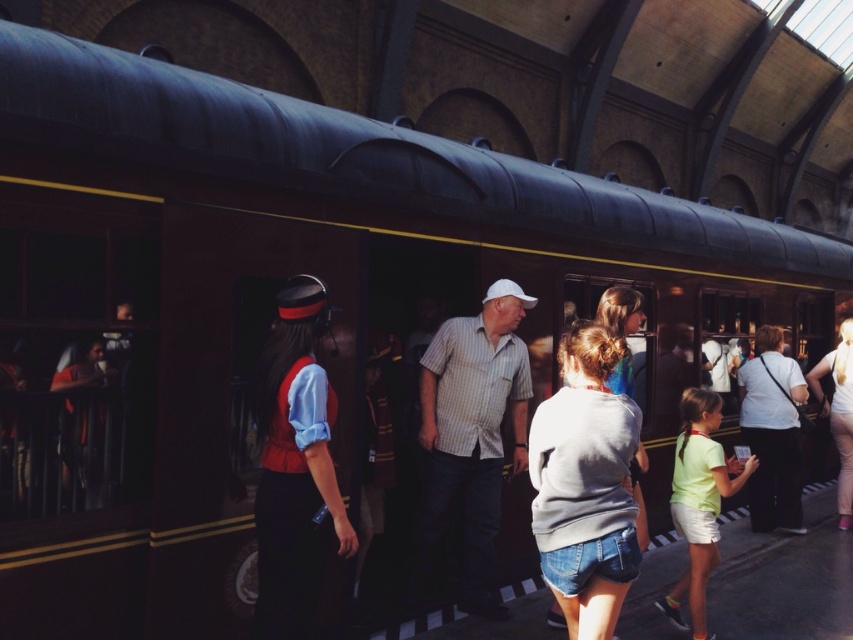
Question: Considering the relative positions of striped cotton shirt at center and light green fabric shirt at center in the image provided, where is striped cotton shirt at center located with respect to light green fabric shirt at center?

Choices:
 (A) right
 (B) left

Answer: (B)

Question: Which object appears farthest from the camera in this image?

Choices:
 (A) light green fabric shirt at center
 (B) gray cotton sweatshirt at center
 (C) striped cotton shirt at center
 (D) white cotton shirt at center

Answer: (D)

Question: Does white cotton shirt at center appear on the right side of white cotton shirt at lower right?

Choices:
 (A) no
 (B) yes

Answer: (A)

Question: Among these objects, which one is nearest to the camera?

Choices:
 (A) white cotton shirt at lower right
 (B) gray cotton sweatshirt at center

Answer: (B)

Question: Which point is farther to the camera?

Choices:
 (A) (492, 545)
 (B) (840, 417)
 (C) (756, 344)

Answer: (B)

Question: Does matte red vest at center have a lesser width compared to white cotton shirt at lower right?

Choices:
 (A) yes
 (B) no

Answer: (A)